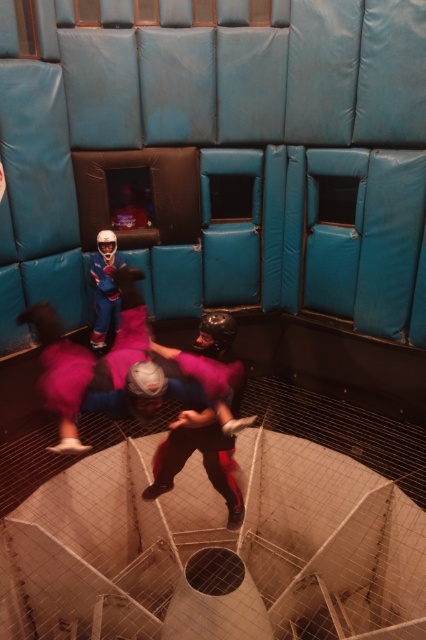
Question: Can you confirm if pink fabric helmet at center is bigger than matte blue suit at center?

Choices:
 (A) no
 (B) yes

Answer: (B)

Question: Which object appears closest to the camera in this image?

Choices:
 (A) pink fabric helmet at center
 (B) matte blue suit at center

Answer: (A)

Question: Can you confirm if pink fabric helmet at center is bigger than matte blue suit at center?

Choices:
 (A) no
 (B) yes

Answer: (B)

Question: Considering the relative positions of pink fabric helmet at center and matte blue suit at center in the image provided, where is pink fabric helmet at center located with respect to matte blue suit at center?

Choices:
 (A) left
 (B) right

Answer: (B)

Question: Which point is farther to the camera?

Choices:
 (A) matte blue suit at center
 (B) pink fabric helmet at center

Answer: (A)